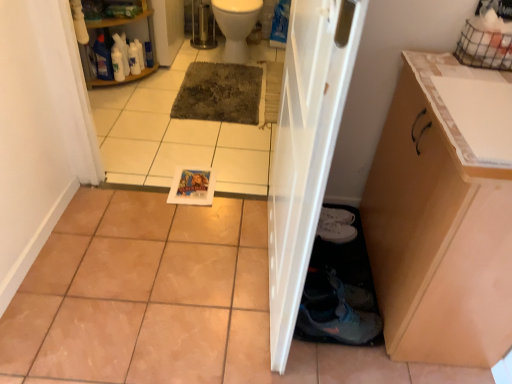
This screenshot has width=512, height=384. Find the location of `gray textured mat at center`. gray textured mat at center is located at coordinates (220, 93).

Where is `white glossy toilet bowl at upper center`? This screenshot has height=384, width=512. white glossy toilet bowl at upper center is located at coordinates (236, 26).

What do you see at coordinates (305, 148) in the screenshot? The width and height of the screenshot is (512, 384). I see `white glossy door at center` at bounding box center [305, 148].

Where is `white tile at lower center`? This screenshot has height=384, width=512. white tile at lower center is located at coordinates (175, 134).

Locate an element on the screen. The height and width of the screenshot is (384, 512). gray textured mat at center is located at coordinates (220, 93).

Considering the positions of objects white glossy toilet bowl at upper center and white glossy door at center in the image provided, who is more to the left, white glossy toilet bowl at upper center or white glossy door at center?

From the viewer's perspective, white glossy toilet bowl at upper center appears more on the left side.

From the image's perspective, is white glossy toilet bowl at upper center above white glossy door at center?

Yes.

Would you say white glossy toilet bowl at upper center is a long distance from white glossy door at center?

That's right, there is a large distance between white glossy toilet bowl at upper center and white glossy door at center.

Considering the sizes of objects white glossy toilet bowl at upper center and white glossy door at center in the image provided, who is bigger, white glossy toilet bowl at upper center or white glossy door at center?

white glossy toilet bowl at upper center is bigger.

In terms of height, does white tile at lower center look taller or shorter compared to white glossy toilet bowl at upper center?

In the image, white tile at lower center appears to be taller than white glossy toilet bowl at upper center.

You are a GUI agent. You are given a task and a screenshot of the screen. Output one action in this format:
    pyautogui.click(x=<x>, y=<y>)
    Task: Click on the tile in front of the white glossy toilet bowl at upper center
    
    Given the screenshot: What is the action you would take?
    pyautogui.click(x=175, y=134)

Looking at their sizes, would you say white tile at lower center is wider or thinner than white glossy toilet bowl at upper center?

In the image, white tile at lower center appears to be more narrow than white glossy toilet bowl at upper center.

Based on the photo, how much distance is there between white tile at lower center and white glossy toilet bowl at upper center?

A distance of 31.69 inches exists between white tile at lower center and white glossy toilet bowl at upper center.

From a real-world perspective, is white glossy door at center positioned above or below white tile at lower center?

white glossy door at center is situated higher than white tile at lower center in the real world.

Is point (278, 355) behind point (269, 147)?

No, it is in front of (269, 147).

Considering the positions of objects white glossy door at center and white tile at lower center in the image provided, who is in front, white glossy door at center or white tile at lower center?

Positioned in front is white glossy door at center.

Can you tell me how much white glossy door at center and white tile at lower center differ in facing direction?

white glossy door at center and white tile at lower center are facing 92.7 degrees away from each other.

Is white tile at lower center aimed at white plastic shelf at upper left?

Yes.

Can you confirm if white tile at lower center is bigger than white plastic shelf at upper left?

Yes.

Considering the positions of objects white tile at lower center and white plastic shelf at upper left in the image provided, who is more to the right, white tile at lower center or white plastic shelf at upper left?

Positioned to the right is white tile at lower center.

Between white tile at lower center and white plastic shelf at upper left, which one has less height?

white plastic shelf at upper left is shorter.

Considering the relative sizes of white tile at lower center and white glossy door at center in the image provided, is white tile at lower center thinner than white glossy door at center?

In fact, white tile at lower center might be wider than white glossy door at center.

From the image's perspective, which is above, white tile at lower center or white glossy door at center?

Answer: white tile at lower center, from the image's perspective.

Considering the sizes of objects white tile at lower center and white glossy door at center in the image provided, who is smaller, white tile at lower center or white glossy door at center?

white tile at lower center.

In the scene shown: Are white tile at lower center and white glossy door at center making contact?

No, white tile at lower center is not touching white glossy door at center.

Considering the relative positions of white glossy door at center and white plastic shelf at upper left in the image provided, is white glossy door at center in front of white plastic shelf at upper left?

That is True.

Is white glossy door at center oriented away from white plastic shelf at upper left?

white glossy door at center does not have its back to white plastic shelf at upper left.

Does white glossy door at center appear on the left side of white plastic shelf at upper left?

Incorrect, white glossy door at center is not on the left side of white plastic shelf at upper left.

In the scene shown: From a real-world perspective, which is physically above, white glossy door at center or white plastic shelf at upper left?

white glossy door at center is physically above.

Does white glossy toilet bowl at upper center have a lesser height compared to white plastic shelf at upper left?

Correct, white glossy toilet bowl at upper center is not as tall as white plastic shelf at upper left.

Can you confirm if white glossy toilet bowl at upper center is wider than white plastic shelf at upper left?

Yes, white glossy toilet bowl at upper center is wider than white plastic shelf at upper left.

Measure the distance from white glossy toilet bowl at upper center to white plastic shelf at upper left.

24.07 inches.

Can white plastic shelf at upper left be found inside white glossy toilet bowl at upper center?

Actually, white plastic shelf at upper left is outside white glossy toilet bowl at upper center.

The height and width of the screenshot is (384, 512). What are the coordinates of `toilet bowl below the white glossy door at center (from a real-world perspective)` in the screenshot? It's located at [x=236, y=26].

Where is `toilet bowl behind the white tile at lower center`? toilet bowl behind the white tile at lower center is located at coordinates (236, 26).

Based on their spatial positions, is white glossy toilet bowl at upper center or white glossy door at center further from white plastic shelf at upper left?

white glossy door at center is positioned further to the anchor white plastic shelf at upper left.

Looking at the image, which one is located further to white glossy door at center, gray textured mat at center or white tile at lower center?

gray textured mat at center is further to white glossy door at center.

From the image, which object appears to be farther from white tile at lower center, white glossy toilet bowl at upper center or white glossy door at center?

Among the two, white glossy door at center is located further to white tile at lower center.

Considering their positions, is white glossy door at center positioned closer to white plastic shelf at upper left than white tile at lower center?

white tile at lower center lies closer to white plastic shelf at upper left than the other object.

Considering their positions, is white glossy toilet bowl at upper center positioned closer to white tile at lower center than white plastic shelf at upper left?

The object closer to white tile at lower center is white plastic shelf at upper left.

Based on their spatial positions, is white tile at lower center or white glossy toilet bowl at upper center further from gray textured mat at center?

Among the two, white glossy toilet bowl at upper center is located further to gray textured mat at center.

Estimate the real-world distances between objects in this image. Which object is closer to white plastic shelf at upper left, white glossy toilet bowl at upper center or white tile at lower center?

The object closer to white plastic shelf at upper left is white tile at lower center.

Consider the image. Based on their spatial positions, is gray textured mat at center or white glossy door at center closer to white plastic shelf at upper left?

Based on the image, gray textured mat at center appears to be nearer to white plastic shelf at upper left.

Find the location of a particular element. tile between white glossy door at center and gray textured mat at center from front to back is located at coordinates (175, 134).

At what (x,y) coordinates should I click in order to perform the action: click on shelf located between white tile at lower center and gray textured mat at center in the depth direction. Please return your answer as a coordinate pair (x, y). The width and height of the screenshot is (512, 384). Looking at the image, I should click on pyautogui.click(x=126, y=28).

Identify the location of shelf located between white glossy door at center and gray textured mat at center in the depth direction. Image resolution: width=512 pixels, height=384 pixels. (126, 28).

Identify the location of mat located between white tile at lower center and white glossy toilet bowl at upper center in the depth direction. (220, 93).